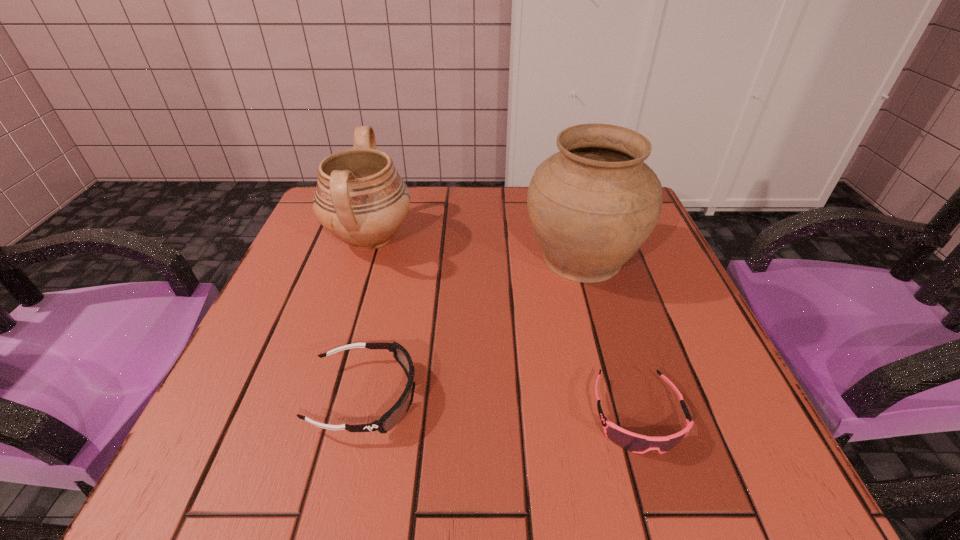
Locate an element on the screen. the right urn is located at coordinates (592, 205).

You are a GUI agent. You are given a task and a screenshot of the screen. Output one action in this format:
    pyautogui.click(x=<x>, y=<y>)
    Task: Click on the tallest object
    This screenshot has width=960, height=540.
    Given the screenshot: What is the action you would take?
    pyautogui.click(x=592, y=205)

The image size is (960, 540). I want to click on the left urn, so click(360, 198).

Identify the location of the third shortest object. This screenshot has width=960, height=540. (360, 198).

The image size is (960, 540). I want to click on the third tallest object, so click(393, 416).

At what (x,y) coordinates should I click in order to perform the action: click on the left goggles. Please return your answer as a coordinate pair (x, y). Image resolution: width=960 pixels, height=540 pixels. Looking at the image, I should click on (393, 416).

The height and width of the screenshot is (540, 960). I want to click on the right goggles, so click(x=636, y=443).

This screenshot has height=540, width=960. What are the coordinates of `the shorter goggles` in the screenshot? It's located at point(636,443).

Image resolution: width=960 pixels, height=540 pixels. Find the location of `vacant point located 0.150m on the front of the right urn`. vacant point located 0.150m on the front of the right urn is located at coordinates (611, 359).

This screenshot has height=540, width=960. Find the location of `free space located 0.370m on the front-facing side of the shorter urn`. free space located 0.370m on the front-facing side of the shorter urn is located at coordinates (575, 237).